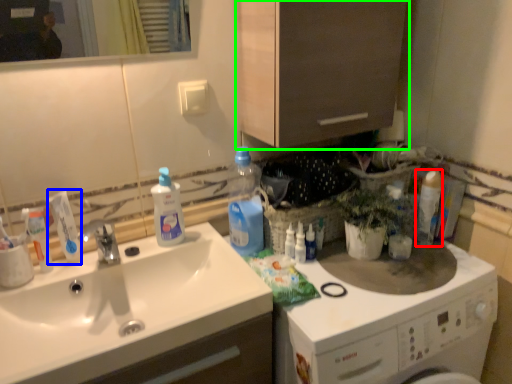
Question: Estimate the real-world distances between objects in this image. Which object is closer to cleaning product (highlighted by a red box), toothpaste (highlighted by a blue box) or cabinetry (highlighted by a green box)?

Choices:
 (A) toothpaste
 (B) cabinetry

Answer: (B)